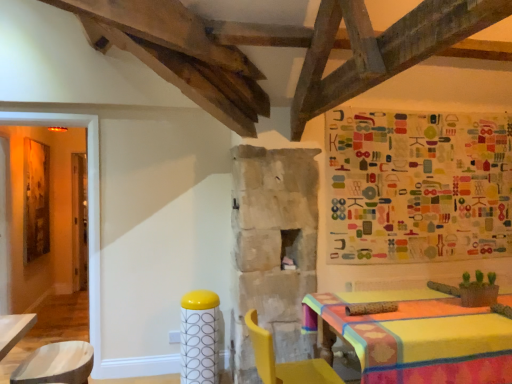
Question: Is yellow glossy bar stool at center bigger than yellow plastic chair at lower right?

Choices:
 (A) no
 (B) yes

Answer: (A)

Question: Is yellow glossy bar stool at center closer to the viewer compared to yellow plastic chair at lower right?

Choices:
 (A) no
 (B) yes

Answer: (A)

Question: Is yellow glossy bar stool at center turned away from yellow plastic chair at lower right?

Choices:
 (A) no
 (B) yes

Answer: (A)

Question: Does yellow glossy bar stool at center have a smaller size compared to yellow plastic chair at lower right?

Choices:
 (A) yes
 (B) no

Answer: (A)

Question: Considering the relative sizes of yellow glossy bar stool at center and yellow plastic chair at lower right in the image provided, is yellow glossy bar stool at center shorter than yellow plastic chair at lower right?

Choices:
 (A) no
 (B) yes

Answer: (A)

Question: Would you say multicolored fabric tapestry at upper right is to the left or to the right of yellow glossy bar stool at center in the picture?

Choices:
 (A) left
 (B) right

Answer: (B)

Question: From the image's perspective, is multicolored fabric tapestry at upper right above or below yellow glossy bar stool at center?

Choices:
 (A) below
 (B) above

Answer: (B)

Question: Looking at their shapes, would you say multicolored fabric tapestry at upper right is wider or thinner than yellow glossy bar stool at center?

Choices:
 (A) wide
 (B) thin

Answer: (B)

Question: From their relative heights in the image, would you say multicolored fabric tapestry at upper right is taller or shorter than yellow glossy bar stool at center?

Choices:
 (A) tall
 (B) short

Answer: (A)

Question: From the image's perspective, is multicolored fabric tapestry at upper right located above or below yellow plastic chair at lower right?

Choices:
 (A) above
 (B) below

Answer: (A)

Question: From a real-world perspective, is multicolored fabric tapestry at upper right physically located above or below yellow plastic chair at lower right?

Choices:
 (A) below
 (B) above

Answer: (B)

Question: Considering the positions of point (487, 254) and point (327, 365), is point (487, 254) closer or farther from the camera than point (327, 365)?

Choices:
 (A) closer
 (B) farther

Answer: (B)

Question: From their relative heights in the image, would you say multicolored fabric tapestry at upper right is taller or shorter than yellow plastic chair at lower right?

Choices:
 (A) tall
 (B) short

Answer: (A)

Question: Considering the positions of yellow plastic chair at lower right and multicolored fabric tapestry at upper right in the image, is yellow plastic chair at lower right bigger or smaller than multicolored fabric tapestry at upper right?

Choices:
 (A) big
 (B) small

Answer: (A)

Question: Considering their positions, is yellow plastic chair at lower right located in front of or behind multicolored fabric tapestry at upper right?

Choices:
 (A) behind
 (B) front

Answer: (B)